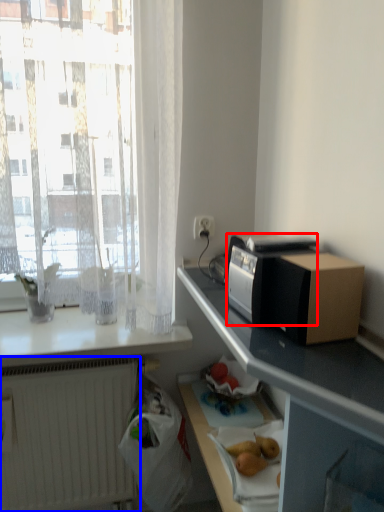
Question: Which object is further to the camera taking this photo, appliance (highlighted by a red box) or radiator (highlighted by a blue box)?

Choices:
 (A) appliance
 (B) radiator

Answer: (B)